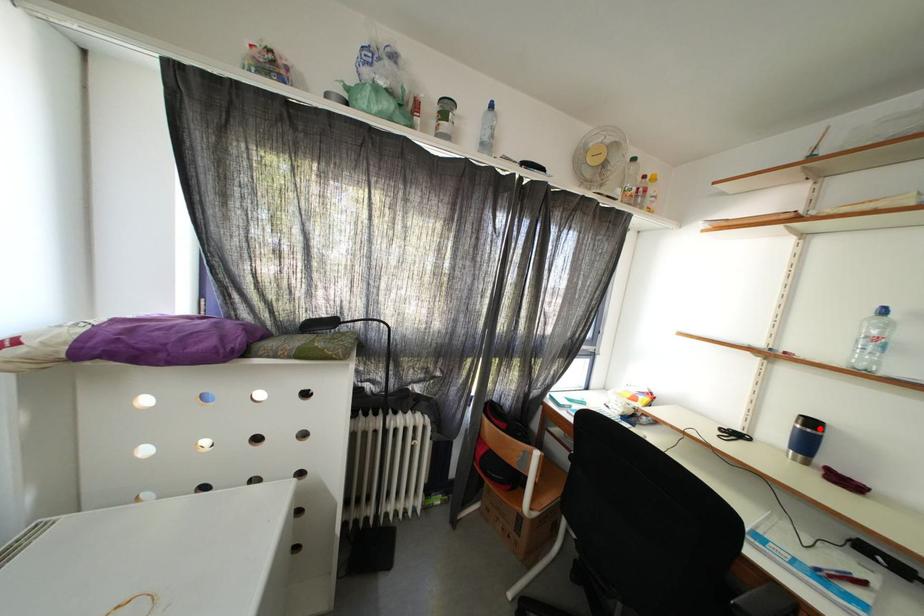
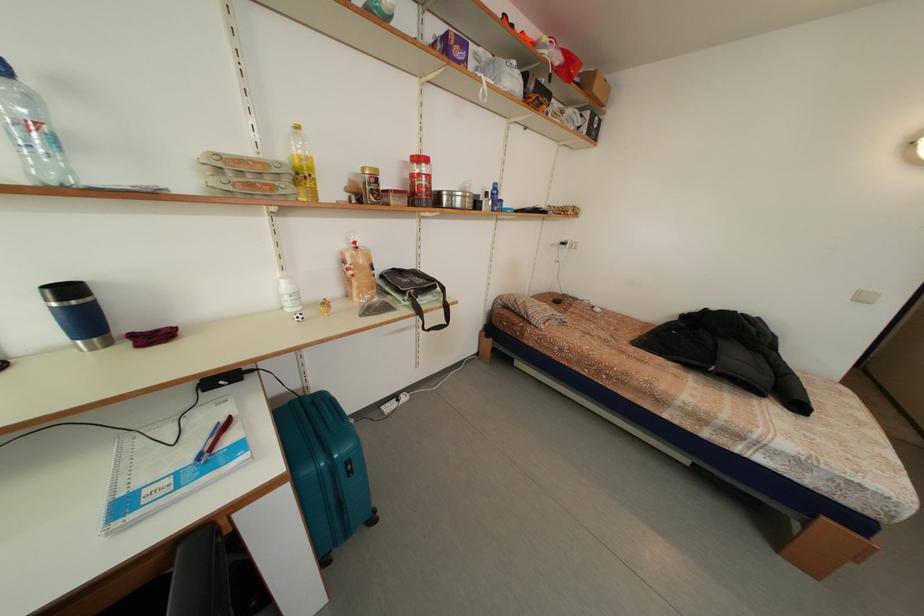
Find the pixel in the second image that matches the highlighted location in the first image.

(78, 296)